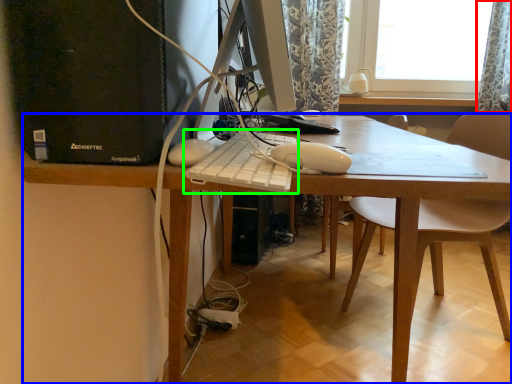
Question: Which object is positioned farthest from curtain (highlighted by a red box)? Select from desk (highlighted by a blue box) and computer keyboard (highlighted by a green box).

Choices:
 (A) desk
 (B) computer keyboard

Answer: (B)